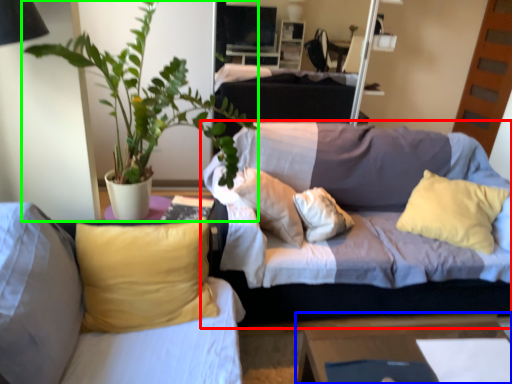
Question: Based on their relative distances, which object is farther from studio couch (highlighted by a red box)? Choose from table (highlighted by a blue box) and houseplant (highlighted by a green box).

Choices:
 (A) table
 (B) houseplant

Answer: (B)